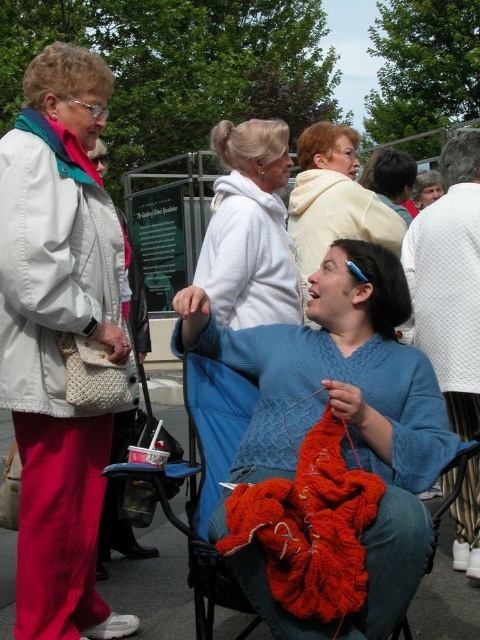
Does knitted wool sweater at center come behind white fleece sweater at center?

No, it is not.

What do you see at coordinates (331, 449) in the screenshot? I see `knitted wool sweater at center` at bounding box center [331, 449].

The image size is (480, 640). I want to click on knitted wool sweater at center, so click(331, 449).

Is point (319, 355) positioned after point (321, 147)?

That is False.

Which of these two, knitted wool sweater at center or matte white sweater at center, stands shorter?

Standing shorter between the two is matte white sweater at center.

Is point (372, 500) more distant than point (324, 252)?

No.

Where is `knitted wool sweater at center`? The image size is (480, 640). knitted wool sweater at center is located at coordinates (331, 449).

Who is lower down, white matte jacket at left or white fleece sweater at center?

white matte jacket at left is below.

Who is more distant from viewer, (54, 227) or (228, 214)?

Positioned behind is point (228, 214).

Where is `white matte jacket at left`? The width and height of the screenshot is (480, 640). white matte jacket at left is located at coordinates (58, 337).